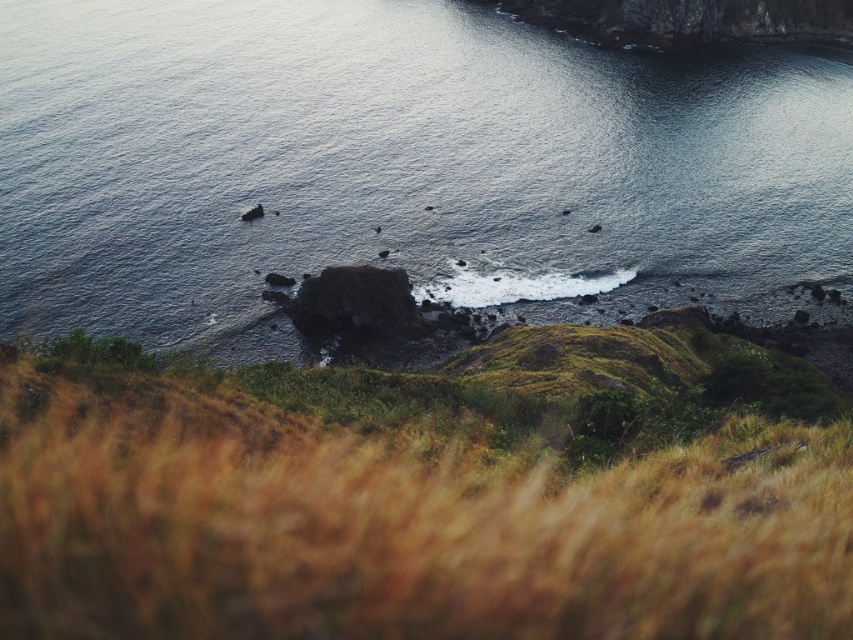
You are a photographer who wants to capture a photo of the dark blue water at center and the brown grassy hillside at lower center. Based on the scene description, which object is positioned higher in the frame?

The dark blue water at center is positioned higher in the frame than the brown grassy hillside at lower center.

You are a photographer who wants to capture the dark blue water at center and the brown grassy hillside at lower center in a single shot. Which object will occupy more of the frame?

The dark blue water at center will occupy more of the frame because it is bigger than the brown grassy hillside at lower center.

You are a photographer who wants to capture the dark blue water at center and the brown grassy hillside at lower center in a single shot. Based on the scene description, which object will appear closer to the top of your camera frame?

The dark blue water at center is taller than the brown grassy hillside at lower center, so it will appear closer to the top of the camera frame.